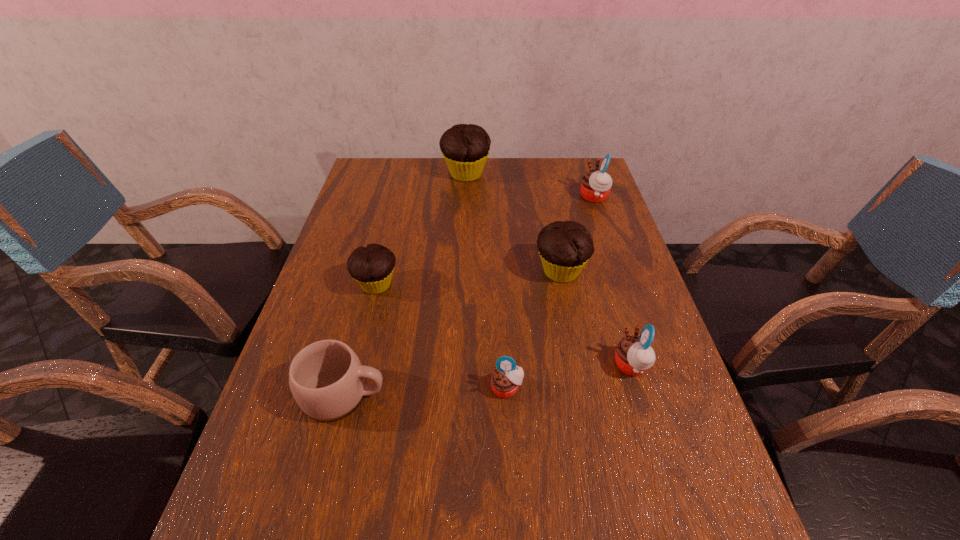
Select which chocolate muffin is the closest to the biggest chocolate muffin. Please provide its 2D coordinates. Your answer should be formatted as a tuple, i.e. [(x, y)], where the tuple contains the x and y coordinates of a point satisfying the conditions above.

[(565, 247)]

This screenshot has height=540, width=960. Find the location of `the third closest pink muffin to the mug`. the third closest pink muffin to the mug is located at coordinates (596, 185).

This screenshot has height=540, width=960. In order to click on pink muffin that stands as the second closest to the second biggest pink muffin in this screenshot , I will do `click(596, 185)`.

At what (x,y) coordinates should I click in order to perform the action: click on vacant point that satisfies the following two spatial constraints: 1. on the front side of the biggest chocolate muffin; 2. on the side of the mug with the handle. Please return your answer as a coordinate pair (x, y). The width and height of the screenshot is (960, 540). Looking at the image, I should click on (456, 395).